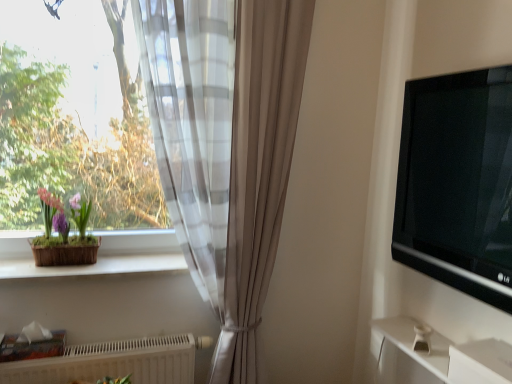
Find the location of a particular element. Image resolution: width=512 pixels, height=384 pixels. vacant area that is in front of matte brown pot at left is located at coordinates (47, 273).